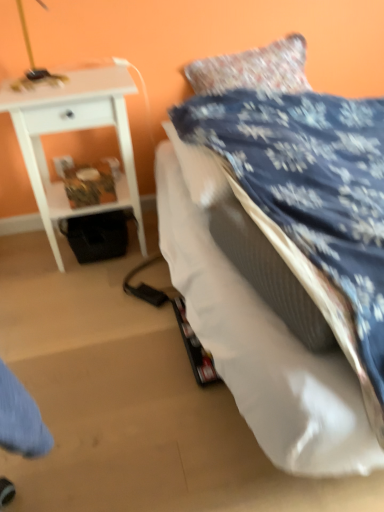
I want to click on free space in front of white glossy nightstand at upper left, so click(x=87, y=301).